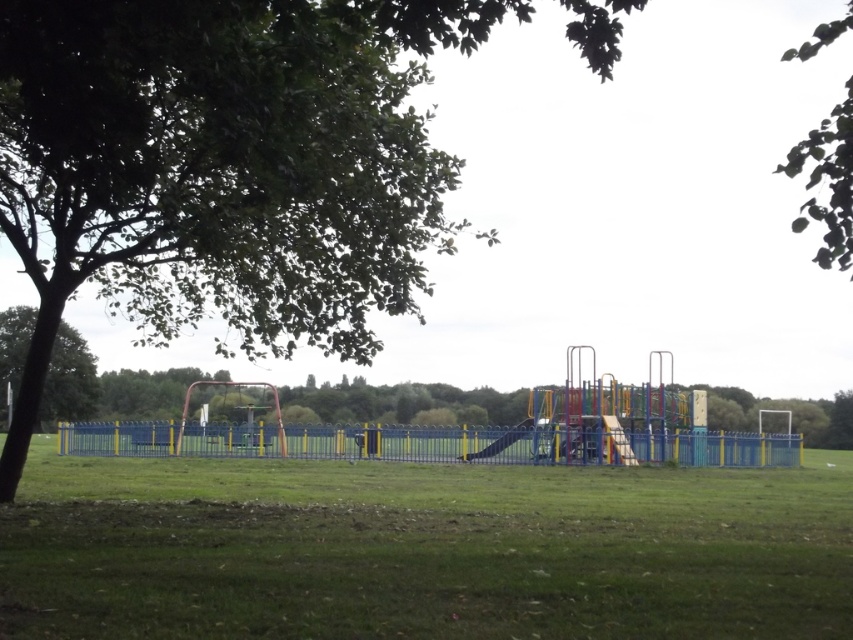
Question: Among these objects, which one is nearest to the camera?

Choices:
 (A) green grassy field at center
 (B) green leafy tree at left

Answer: (A)

Question: Observing the image, what is the correct spatial positioning of green grassy field at center in reference to smooth plastic slide at center?

Choices:
 (A) right
 (B) left

Answer: (B)

Question: Is green leafy tree at upper right wider than green leafy tree at left?

Choices:
 (A) yes
 (B) no

Answer: (A)

Question: Among these points, which one is farthest from the camera?

Choices:
 (A) (814, 44)
 (B) (500, 442)
 (C) (460, 506)

Answer: (A)

Question: Which of the following is the closest to the observer?

Choices:
 (A) green leafy tree at upper right
 (B) green leafy tree at upper left
 (C) green grassy field at center
 (D) smooth plastic slide at center

Answer: (C)

Question: Can you confirm if green leafy tree at upper left is positioned to the right of green grassy field at center?

Choices:
 (A) yes
 (B) no

Answer: (B)